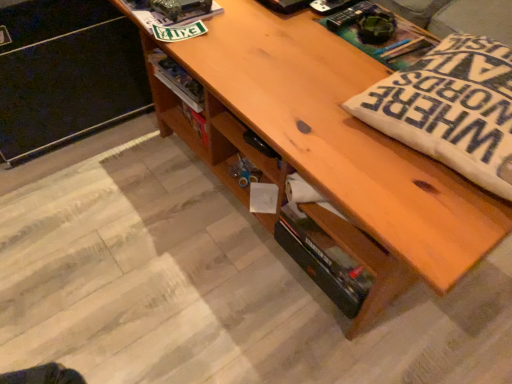
Where is `white fabric pillow at right`? white fabric pillow at right is located at coordinates (451, 109).

Identify the location of white fabric pillow at right. (451, 109).

Based on their sizes in the image, would you say wooden file cabinet at lower left is bigger or smaller than wooden shelf at upper center?

wooden file cabinet at lower left is bigger than wooden shelf at upper center.

Considering the positions of objects wooden file cabinet at lower left and wooden shelf at upper center in the image provided, who is more to the right, wooden file cabinet at lower left or wooden shelf at upper center?

wooden shelf at upper center is more to the right.

In terms of height, does wooden file cabinet at lower left look taller or shorter compared to wooden shelf at upper center?

Clearly, wooden file cabinet at lower left is taller compared to wooden shelf at upper center.

Is wooden file cabinet at lower left at the left side of white fabric pillow at right?

Indeed, wooden file cabinet at lower left is positioned on the left side of white fabric pillow at right.

Consider the image. Considering the relative sizes of wooden file cabinet at lower left and white fabric pillow at right in the image provided, is wooden file cabinet at lower left thinner than white fabric pillow at right?

Correct, the width of wooden file cabinet at lower left is less than that of white fabric pillow at right.

How many degrees apart are the facing directions of wooden file cabinet at lower left and white fabric pillow at right?

83.9 degrees separate the facing orientations of wooden file cabinet at lower left and white fabric pillow at right.

Is wooden file cabinet at lower left facing away from white fabric pillow at right?

No, white fabric pillow at right is not at the back of wooden file cabinet at lower left.

Considering the relative positions of wooden shelf at upper center and white fabric pillow at right in the image provided, is wooden shelf at upper center in front of white fabric pillow at right?

No, it is behind white fabric pillow at right.

In the scene shown: Is wooden shelf at upper center positioned with its back to white fabric pillow at right?

wooden shelf at upper center does not have its back to white fabric pillow at right.

From the image's perspective, which is above, wooden shelf at upper center or white fabric pillow at right?

wooden shelf at upper center is shown above in the image.

Which is more to the right, wooden shelf at upper center or white fabric pillow at right?

white fabric pillow at right.

Would you say white fabric pillow at right is a long distance from wooden shelf at upper center?

That's not correct — white fabric pillow at right is a little close to wooden shelf at upper center.

Which is behind, point (387, 128) or point (185, 93)?

The point (185, 93) is farther from the camera.

Considering the sizes of objects white fabric pillow at right and wooden shelf at upper center in the image provided, who is bigger, white fabric pillow at right or wooden shelf at upper center?

white fabric pillow at right.

Does white fabric pillow at right have a greater width compared to wooden shelf at upper center?

Indeed, white fabric pillow at right has a greater width compared to wooden shelf at upper center.

From a real-world perspective, is wooden shelf at upper center positioned over wooden file cabinet at lower left based on gravity?

Correct, in the physical world, wooden shelf at upper center is higher than wooden file cabinet at lower left.

Between wooden shelf at upper center and wooden file cabinet at lower left, which one appears on the left side from the viewer's perspective?

Positioned to the left is wooden file cabinet at lower left.

Consider the image. Is wooden shelf at upper center facing away from wooden file cabinet at lower left?

No.

Is point (170, 119) positioned before point (73, 55)?

No.

From the picture: Can you tell me how much white fabric pillow at right and wooden file cabinet at lower left differ in facing direction?

The angle between the facing direction of white fabric pillow at right and the facing direction of wooden file cabinet at lower left is 83.9 degrees.

Which object is closer to the camera, white fabric pillow at right or wooden file cabinet at lower left?

Positioned in front is white fabric pillow at right.

From a real-world perspective, which is physically above, white fabric pillow at right or wooden file cabinet at lower left?

white fabric pillow at right is physically above.

Identify the location of throw pillow below the wooden file cabinet at lower left (from the image's perspective). Image resolution: width=512 pixels, height=384 pixels. [x=451, y=109].

What are the coordinates of `file cabinet below the wooden shelf at upper center (from a real-world perspective)` in the screenshot? It's located at (66, 73).

The image size is (512, 384). Identify the location of throw pillow to the right of wooden file cabinet at lower left. (451, 109).

Looking at the image, which one is located further to wooden file cabinet at lower left, white fabric pillow at right or wooden shelf at upper center?

white fabric pillow at right is positioned further to the anchor wooden file cabinet at lower left.

Which object lies further to the anchor point wooden file cabinet at lower left, wooden shelf at upper center or white fabric pillow at right?

The object further to wooden file cabinet at lower left is white fabric pillow at right.

Estimate the real-world distances between objects in this image. Which object is closer to wooden shelf at upper center, white fabric pillow at right or wooden file cabinet at lower left?

Among the two, wooden file cabinet at lower left is located nearer to wooden shelf at upper center.

When comparing their distances from white fabric pillow at right, does wooden file cabinet at lower left or wooden shelf at upper center seem closer?

wooden shelf at upper center is positioned closer to the anchor white fabric pillow at right.

Estimate the real-world distances between objects in this image. Which object is closer to wooden shelf at upper center, wooden file cabinet at lower left or white fabric pillow at right?

wooden file cabinet at lower left is positioned closer to the anchor wooden shelf at upper center.

Which object lies nearer to the anchor point white fabric pillow at right, wooden shelf at upper center or wooden file cabinet at lower left?

Among the two, wooden shelf at upper center is located nearer to white fabric pillow at right.

Where is `shelf located between wooden file cabinet at lower left and white fabric pillow at right in the left-right direction`? The image size is (512, 384). shelf located between wooden file cabinet at lower left and white fabric pillow at right in the left-right direction is located at coordinates (175, 107).